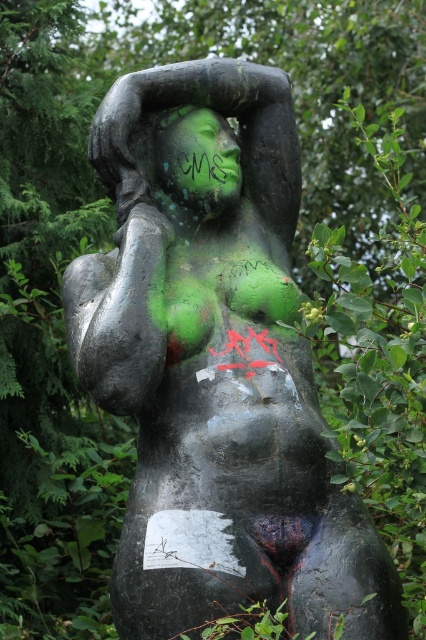
You are a painter standing 2 meters away from the matte black statue at center. You want to paint the statue but need to be within 2 meters to do so effectively. Can you reach the statue from your current position?

The distance between the matte black statue at center and the viewer is 2.10 meters, so you are slightly out of range. Move 10 centimeters closer to be within the 2 meter requirement.

You are a tour guide explaining the statue to visitors. You want to point out the green matte face at center to them. Which direction should you move your hand relative to the matte black statue at center to indicate its location?

The matte black statue at center is in front of the green matte face at center, so you should move your hand backward from the matte black statue at center to point toward the green matte face at center.